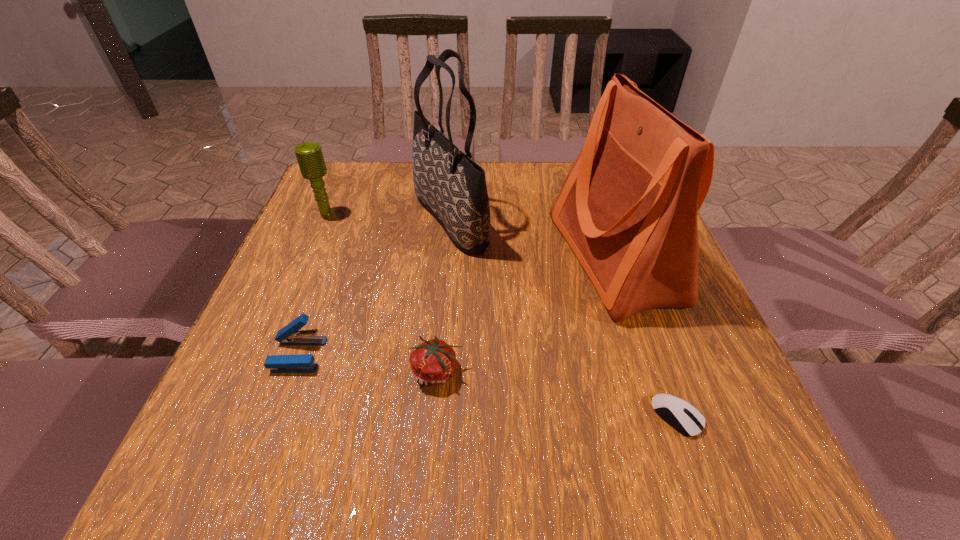
Select which object appears as the fifth closest to the shopping bag. Please provide its 2D coordinates. Your answer should be formatted as a tuple, i.e. [(x, y)], where the tuple contains the x and y coordinates of a point satisfying the conditions above.

[(309, 155)]

Point out which object is positioned as the second nearest to the mouse. Please provide its 2D coordinates. Your answer should be formatted as a tuple, i.e. [(x, y)], where the tuple contains the x and y coordinates of a point satisfying the conditions above.

[(433, 362)]

I want to click on free location that satisfies the following two spatial constraints: 1. on the front side of the tomato; 2. on the left side of the nearest object, so click(433, 416).

I want to click on vacant space that satisfies the following two spatial constraints: 1. on the front side of the stapler; 2. on the left side of the mouse, so click(x=276, y=416).

Where is `free spot that satisfies the following two spatial constraints: 1. on the back side of the shopping bag; 2. on the left side of the stapler`? This screenshot has width=960, height=540. free spot that satisfies the following two spatial constraints: 1. on the back side of the shopping bag; 2. on the left side of the stapler is located at coordinates (333, 259).

Identify the location of vacant space that satisfies the following two spatial constraints: 1. on the front side of the third tallest object; 2. on the right side of the shopping bag. This screenshot has height=540, width=960. pyautogui.click(x=309, y=259).